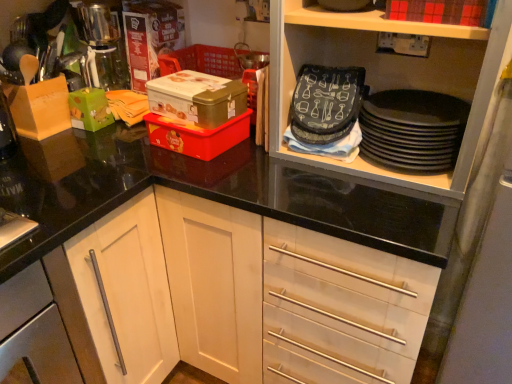
Question: Is red matte box at upper right, which is counted as the 4th box, starting from the left, wider or thinner than green matte box at left, which is the first box in left-to-right order?

Choices:
 (A) wide
 (B) thin

Answer: (A)

Question: From a real-world perspective, is red matte box at upper right, which is counted as the 4th box, starting from the left, physically located above or below green matte box at left, which ranks as the fourth box in right-to-left order?

Choices:
 (A) above
 (B) below

Answer: (A)

Question: Which is nearer to the black matte plates at upper right?

Choices:
 (A) red plastic container at center, the second box in the right-to-left sequence
 (B) brushed metal coffee machine at upper left
 (C) green matte box at left, which ranks as the fourth box in right-to-left order
 (D) red matte box at upper right, which is the first box in right-to-left order
 (E) silver metallic cabinet handle at lower left

Answer: (D)

Question: Based on their relative distances, which object is farther from the red matte box at upper right, which is counted as the 4th box, starting from the left?

Choices:
 (A) black matte plates at upper right
 (B) green matte box at left, which ranks as the fourth box in right-to-left order
 (C) red plastic container at center, placed as the 3th box when sorted from left to right
 (D) silver metallic cabinet handle at lower left
 (E) metallic gold box at center, which is counted as the second box, starting from the left

Answer: (D)